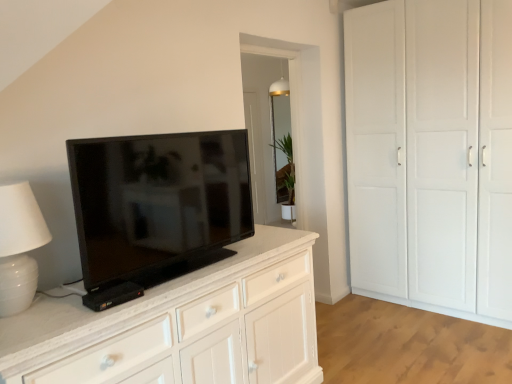
What do you see at coordinates (158, 204) in the screenshot? This screenshot has height=384, width=512. I see `black glossy tv at center` at bounding box center [158, 204].

The height and width of the screenshot is (384, 512). Find the location of `white matte cupboard at right`. white matte cupboard at right is located at coordinates (431, 154).

Where is `white ceramic table lamp at left`? The width and height of the screenshot is (512, 384). white ceramic table lamp at left is located at coordinates (19, 246).

This screenshot has width=512, height=384. I want to click on black glossy tv at center, so point(158,204).

Measure the distance from white ceramic table lamp at left to white matte cupboard at right.

8.84 feet.

Could you tell me if white ceramic table lamp at left is facing white matte cupboard at right?

No, white ceramic table lamp at left does not turn towards white matte cupboard at right.

From their relative heights in the image, would you say white ceramic table lamp at left is taller or shorter than white matte cupboard at right?

Considering their sizes, white ceramic table lamp at left has less height than white matte cupboard at right.

From the image's perspective, which is above, white ceramic table lamp at left or white matte cupboard at right?

white matte cupboard at right is shown above in the image.

Locate an element on the screen. The width and height of the screenshot is (512, 384). cupboard that is on the right side of black glossy tv at center is located at coordinates (431, 154).

In the scene shown: How distant is white matte cupboard at right from black glossy tv at center?

A distance of 1.90 meters exists between white matte cupboard at right and black glossy tv at center.

Can you confirm if white matte cupboard at right is thinner than black glossy tv at center?

No, white matte cupboard at right is not thinner than black glossy tv at center.

Can you confirm if white matte cupboard at right is shorter than black glossy tv at center?

Incorrect, the height of white matte cupboard at right does not fall short of that of black glossy tv at center.

Is black glossy tv at center positioned before green matte plant at center?

Yes, it is.

From the image's perspective, is black glossy tv at center located above green matte plant at center?

No, from the image's perspective, black glossy tv at center is not over green matte plant at center.

Does black glossy tv at center turn towards green matte plant at center?

No, black glossy tv at center is not turned towards green matte plant at center.

Would you consider black glossy tv at center to be distant from green matte plant at center?

black glossy tv at center is far away from green matte plant at center.

Find the location of a particular element. Image resolution: width=512 pixels, height=384 pixels. television that is above the white matte cupboard at right (from a real-world perspective) is located at coordinates point(158,204).

From the image's perspective, would you say black glossy tv at center is positioned over white matte cupboard at right?

No, from the image's perspective, black glossy tv at center is not over white matte cupboard at right.

Which of these two, black glossy tv at center or white matte cupboard at right, is wider?

white matte cupboard at right is wider.

Would you say black glossy tv at center contains white matte cupboard at right?

No, black glossy tv at center does not contain white matte cupboard at right.

From their relative heights in the image, would you say white ceramic table lamp at left is taller or shorter than black glossy tv at center?

Considering their sizes, white ceramic table lamp at left has less height than black glossy tv at center.

Which is closer, (14, 304) or (185, 197)?

Clearly, point (14, 304) is closer to the camera than point (185, 197).

What's the angular difference between white ceramic table lamp at left and black glossy tv at center's facing directions?

white ceramic table lamp at left and black glossy tv at center are facing 1.68 degrees away from each other.

Is white ceramic table lamp at left not near black glossy tv at center?

No, white ceramic table lamp at left is not far away from black glossy tv at center.

In the scene shown: Can you confirm if white matte cupboard at right is positioned to the right of green matte plant at center?

Correct, you'll find white matte cupboard at right to the right of green matte plant at center.

Who is taller, white matte cupboard at right or green matte plant at center?

white matte cupboard at right.

Relative to green matte plant at center, is white matte cupboard at right in front or behind?

Visually, white matte cupboard at right is located in front of green matte plant at center.

Is white matte cupboard at right aimed at white ceramic table lamp at left?

Yes.

Considering the points (382, 108) and (35, 267), which point is behind, point (382, 108) or point (35, 267)?

The point (382, 108) is more distant.

How different are the orientations of white matte cupboard at right and white ceramic table lamp at left in degrees?

The angle between the facing direction of white matte cupboard at right and the facing direction of white ceramic table lamp at left is 92.4 degrees.

From a real-world perspective, is white matte cupboard at right physically located above or below white ceramic table lamp at left?

Clearly, from a real-world perspective, white matte cupboard at right is above white ceramic table lamp at left.

Image resolution: width=512 pixels, height=384 pixels. What are the coordinates of `cupboard above the white ceramic table lamp at left (from a real-world perspective)` in the screenshot? It's located at (431, 154).

Locate an element on the screen. Image resolution: width=512 pixels, height=384 pixels. cupboard above the black glossy tv at center (from the image's perspective) is located at coordinates (431, 154).

Based on their spatial positions, is black glossy tv at center or white matte cupboard at right closer to white ceramic table lamp at left?

black glossy tv at center lies closer to white ceramic table lamp at left than the other object.

Looking at this image, based on their spatial positions, is white matte cupboard at right or black glossy tv at center closer to white ceramic table lamp at left?

Based on the image, black glossy tv at center appears to be nearer to white ceramic table lamp at left.

From the image, which object appears to be nearer to white ceramic table lamp at left, black glossy tv at center or green matte plant at center?

Among the two, black glossy tv at center is located nearer to white ceramic table lamp at left.

Estimate the real-world distances between objects in this image. Which object is further from black glossy tv at center, white matte cupboard at right or white ceramic table lamp at left?

Based on the image, white matte cupboard at right appears to be further to black glossy tv at center.

Which object lies further to the anchor point white ceramic table lamp at left, white matte cupboard at right or green matte plant at center?

Based on the image, green matte plant at center appears to be further to white ceramic table lamp at left.

Based on their spatial positions, is black glossy tv at center or white matte cupboard at right further from green matte plant at center?

The object further to green matte plant at center is black glossy tv at center.

Looking at the image, which one is located further to white matte cupboard at right, black glossy tv at center or white ceramic table lamp at left?

white ceramic table lamp at left is positioned further to the anchor white matte cupboard at right.

Looking at the image, which one is located further to green matte plant at center, white ceramic table lamp at left or black glossy tv at center?

white ceramic table lamp at left is further to green matte plant at center.

Locate an element on the screen. television between white ceramic table lamp at left and white matte cupboard at right is located at coordinates (158, 204).

At what (x,y) coordinates should I click in order to perform the action: click on television positioned between white ceramic table lamp at left and green matte plant at center from near to far. Please return your answer as a coordinate pair (x, y). The height and width of the screenshot is (384, 512). Looking at the image, I should click on (158, 204).

Identify the location of cupboard between white ceramic table lamp at left and green matte plant at center along the z-axis. [x=431, y=154].

Where is `cupboard between black glossy tv at center and green matte plant at center along the z-axis`? This screenshot has width=512, height=384. cupboard between black glossy tv at center and green matte plant at center along the z-axis is located at coordinates (431, 154).